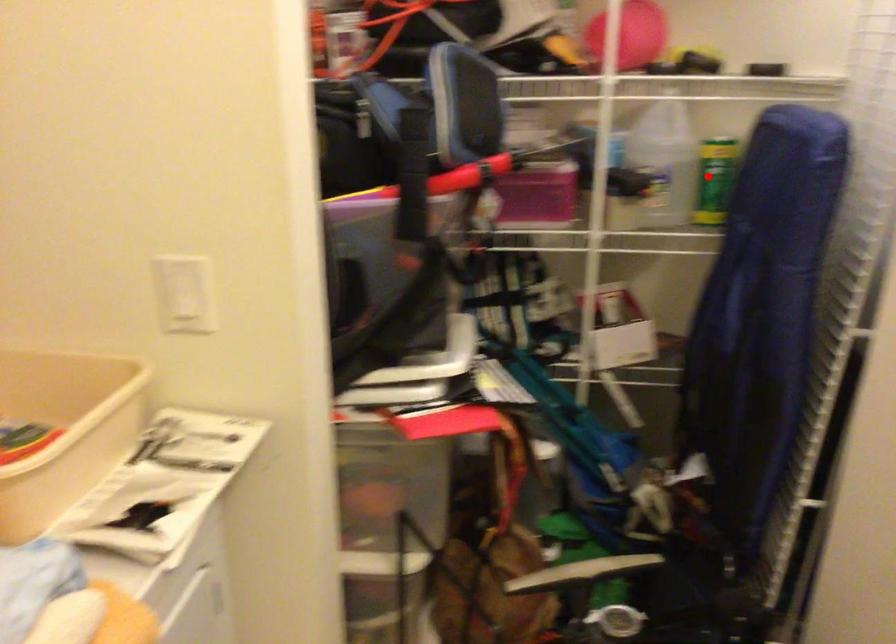
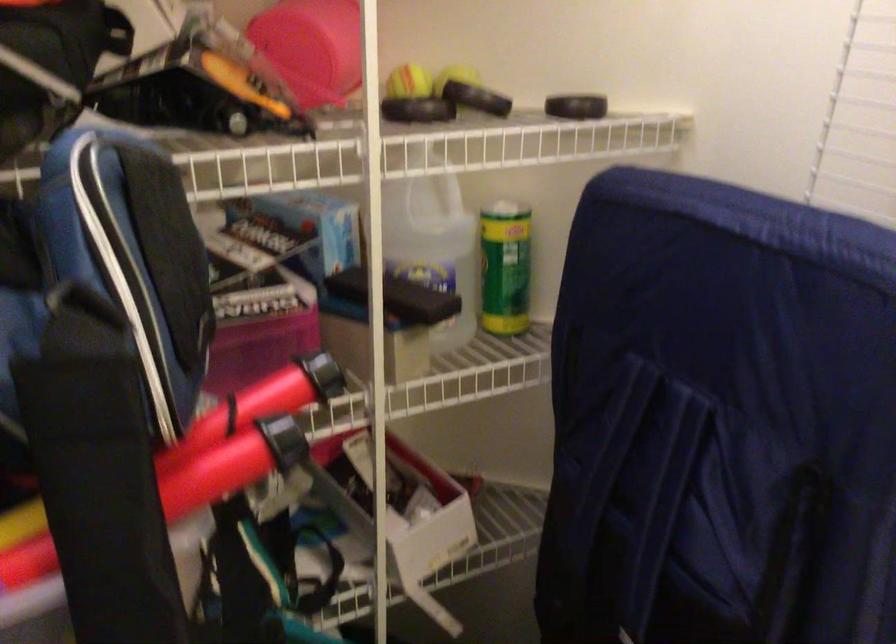
In the second image, find the point that corresponds to the highlighted location in the first image.

(504, 267)